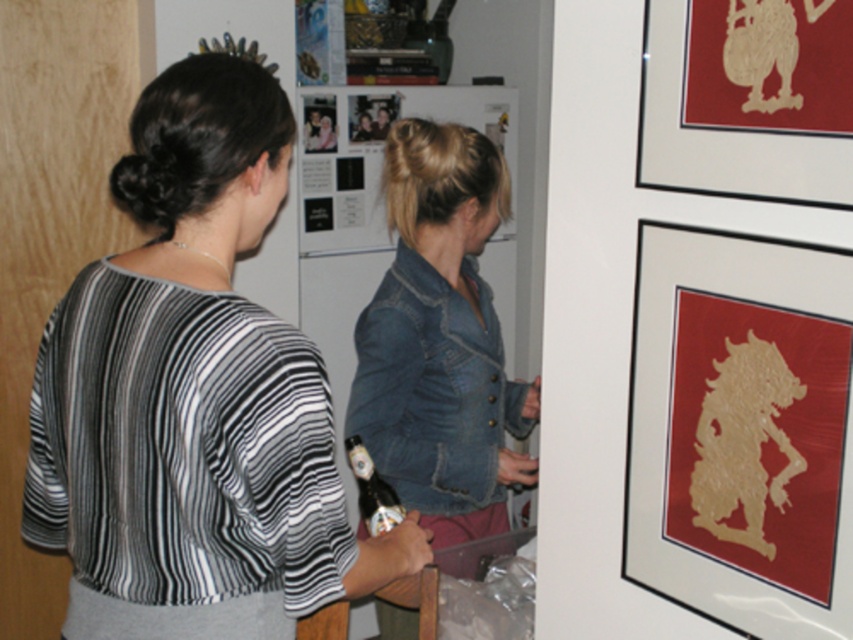
Which is more to the right, striped fabric blouse at left or gold textured paper at upper right?

gold textured paper at upper right is more to the right.

In the scene shown: Between striped fabric blouse at left and gold textured paper at upper right, which one has more height?

With more height is striped fabric blouse at left.

I want to click on striped fabric blouse at left, so click(193, 396).

Find the location of a particular element. This screenshot has width=853, height=640. striped fabric blouse at left is located at coordinates (193, 396).

Which is behind, point (183, 625) or point (671, 570)?

The point (671, 570) is more distant.

Which is above, striped fabric blouse at left or gold paper silhouette at upper right?

striped fabric blouse at left is above.

Does point (125, 557) come farther from viewer compared to point (815, 460)?

Yes, it is behind point (815, 460).

Identify the location of striped fabric blouse at left. This screenshot has width=853, height=640. (193, 396).

Can you confirm if gold paper silhouette at upper right is thinner than gold textured paper at upper right?

No, gold paper silhouette at upper right is not thinner than gold textured paper at upper right.

Is gold paper silhouette at upper right further to camera compared to gold textured paper at upper right?

Yes, gold paper silhouette at upper right is behind gold textured paper at upper right.

Locate an element on the screen. gold paper silhouette at upper right is located at coordinates coord(741,429).

Locate an element on the screen. gold paper silhouette at upper right is located at coordinates (741, 429).